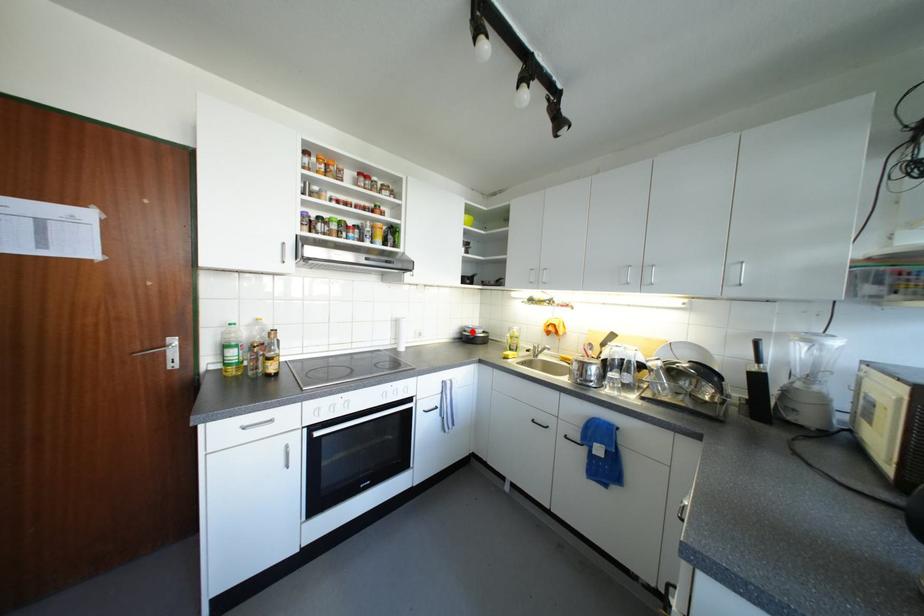
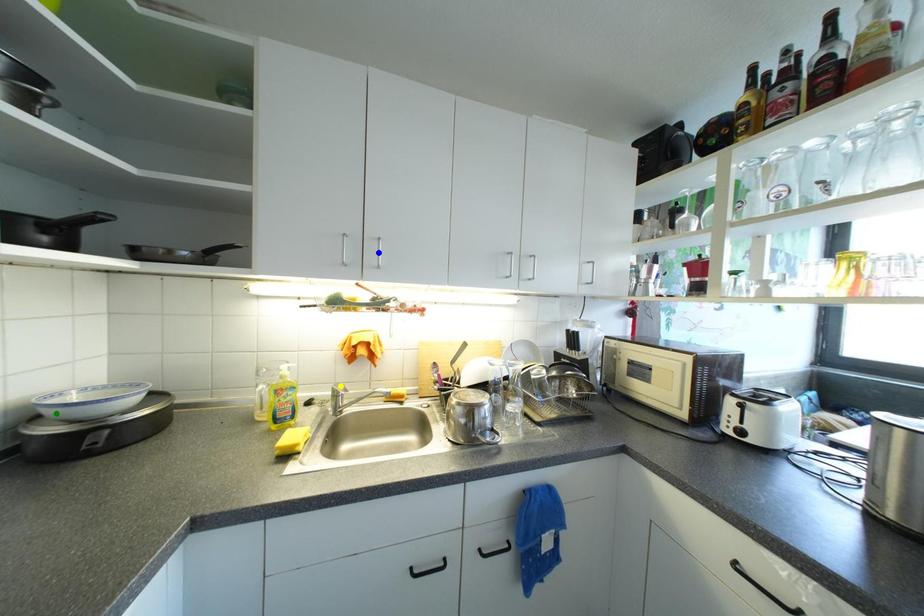
Question: I am providing you with two images of the same scene from different viewpoints. A red point is marked on the first image. You are given multiple points on the second image. Which spot in image 2 lines up with the point in image 1?

Choices:
 (A) blue point
 (B) green point
 (C) yellow point

Answer: (B)